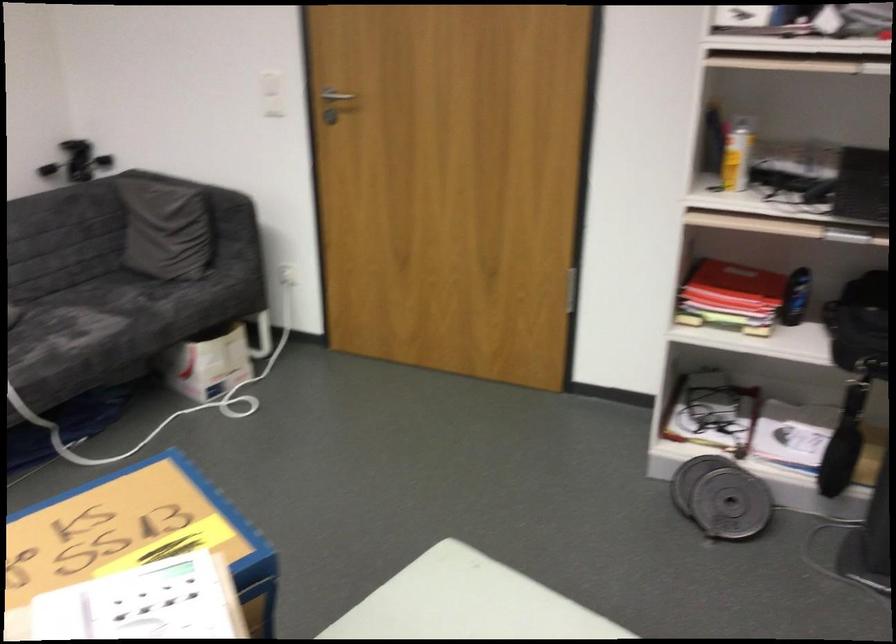
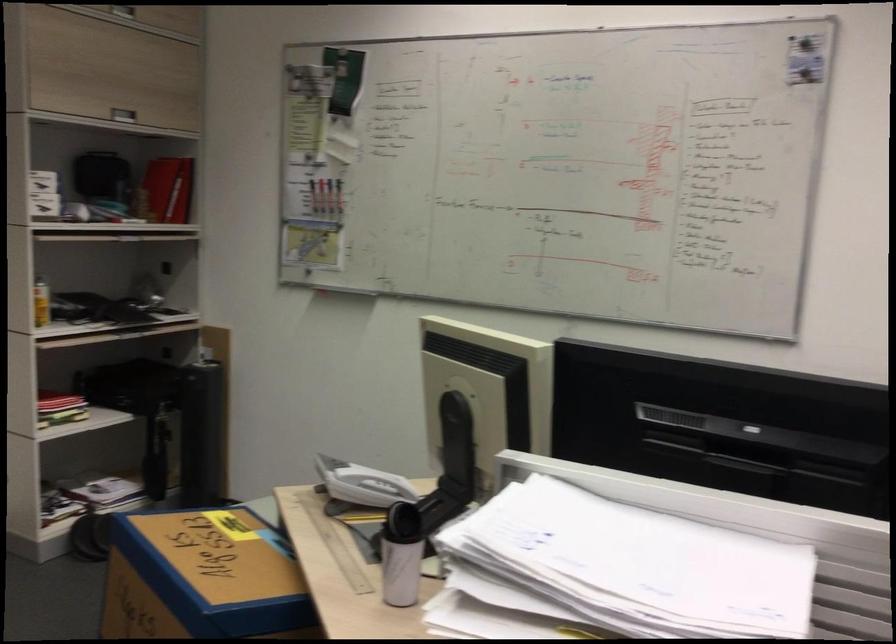
Question: I am providing you with two images of the same scene from different viewpoints. Please identify which objects are invisible in image2.

Choices:
 (A) red cream tube
 (B) metal weight plate
 (C) blue cardboard box
 (D) black storage case

Answer: (B)